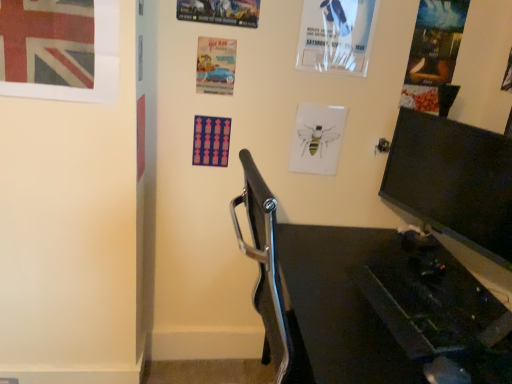
Question: Is matte paper poster at upper right, which is counted as the first poster page, starting from the right, facing towards black glossy monitor at right?

Choices:
 (A) yes
 (B) no

Answer: (B)

Question: Does matte paper poster at upper right, which is counted as the first poster page, starting from the right, have a greater height compared to black glossy monitor at right?

Choices:
 (A) yes
 (B) no

Answer: (A)

Question: Can you confirm if matte paper poster at upper right, the 6th poster page viewed from the left, is shorter than black glossy monitor at right?

Choices:
 (A) yes
 (B) no

Answer: (B)

Question: Does matte paper poster at upper right, which is counted as the first poster page, starting from the right, lie in front of black glossy monitor at right?

Choices:
 (A) yes
 (B) no

Answer: (B)

Question: From the image's perspective, is matte paper poster at upper right, the 6th poster page viewed from the left, on top of black glossy monitor at right?

Choices:
 (A) no
 (B) yes

Answer: (B)

Question: From a real-world perspective, is matte paper poster at upper right, which is counted as the first poster page, starting from the right, positioned under black glossy monitor at right based on gravity?

Choices:
 (A) yes
 (B) no

Answer: (B)

Question: Is matte plastic poster at center, the first poster page when ordered from left to right, bigger than matte paper poster at upper right, the 6th poster page viewed from the left?

Choices:
 (A) yes
 (B) no

Answer: (B)

Question: Does matte plastic poster at center, the first poster page when ordered from left to right, have a smaller size compared to matte paper poster at upper right, which is counted as the first poster page, starting from the right?

Choices:
 (A) no
 (B) yes

Answer: (B)

Question: Is matte plastic poster at center, the first poster page when ordered from left to right, not within matte paper poster at upper right, which is counted as the first poster page, starting from the right?

Choices:
 (A) yes
 (B) no

Answer: (A)

Question: From a real-world perspective, is matte plastic poster at center, the first poster page when ordered from left to right, beneath matte paper poster at upper right, the 6th poster page viewed from the left?

Choices:
 (A) yes
 (B) no

Answer: (A)

Question: Does matte plastic poster at center, the first poster page when ordered from left to right, have a lesser width compared to matte paper poster at upper right, which is counted as the first poster page, starting from the right?

Choices:
 (A) no
 (B) yes

Answer: (A)

Question: Is matte paper poster at upper right, the 6th poster page viewed from the left, located within matte plastic poster at center, the 6th poster page positioned from the right?

Choices:
 (A) no
 (B) yes

Answer: (A)

Question: Is union jack flag at upper left located within blue glossy car at center, the fifth poster page in the right-to-left sequence?

Choices:
 (A) no
 (B) yes

Answer: (A)